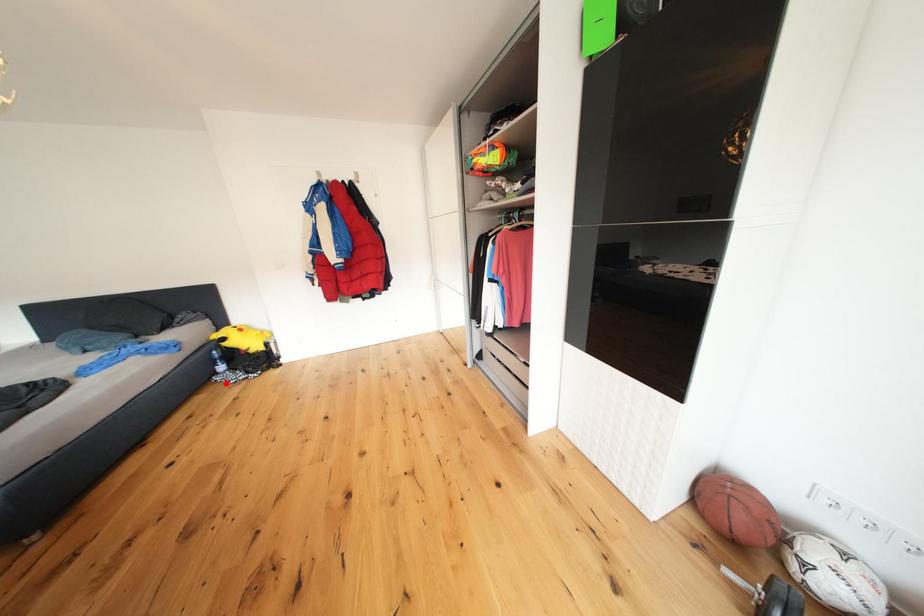
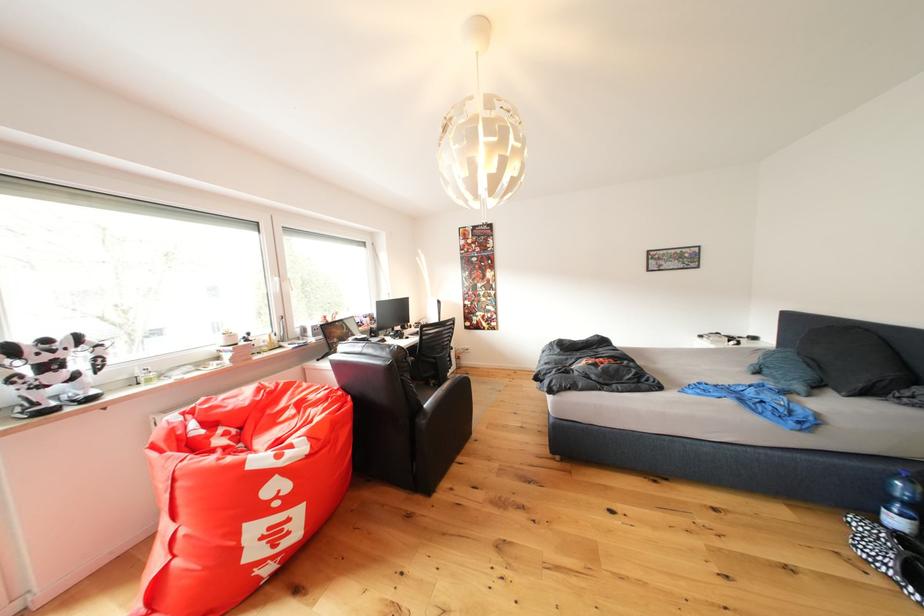
Locate, in the second image, the point that corresponds to the highlighted location in the first image.

(864, 527)